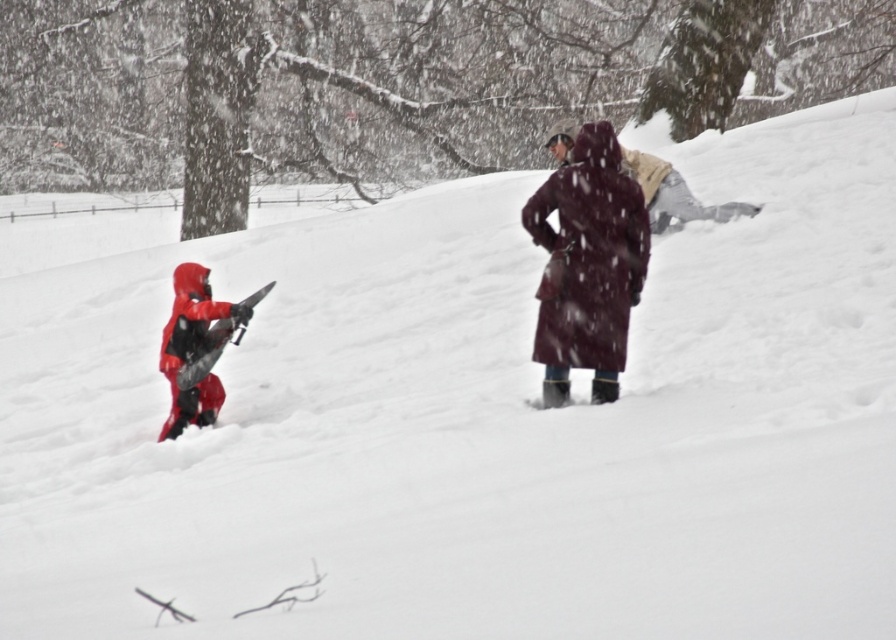
You are a parent trying to choose between two winter outfits for your child. You see the velvet maroon coat at center and the matte red snowsuit at left in the store display. Based on their sizes, which one would be more suitable for a taller child?

The velvet maroon coat at center has a larger size compared to the matte red snowsuit at left, so it would be more suitable for a taller child.

You are a photographer trying to capture both the velvet maroon coat at center and the matte red snowsuit at left in a single frame. Given their sizes, which object should you focus on to ensure both fit in the photo without cropping?

The velvet maroon coat at center is wider than the matte red snowsuit at left, so you should focus on the velvet maroon coat at center to ensure both fit in the photo without cropping.